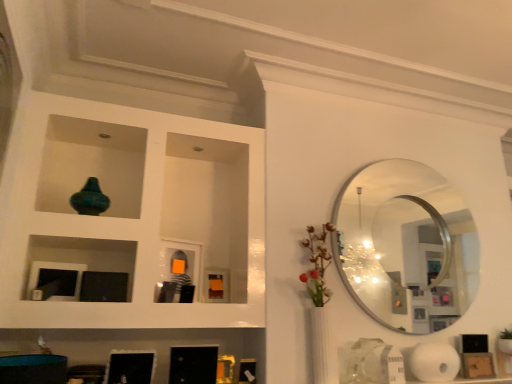
Question: Is teal glass vase at upper left smaller than silver metallic mirror at upper right?

Choices:
 (A) no
 (B) yes

Answer: (B)

Question: Is teal glass vase at upper left surrounding silver metallic mirror at upper right?

Choices:
 (A) yes
 (B) no

Answer: (B)

Question: Does teal glass vase at upper left have a lesser height compared to silver metallic mirror at upper right?

Choices:
 (A) no
 (B) yes

Answer: (B)

Question: From a real-world perspective, is teal glass vase at upper left located beneath silver metallic mirror at upper right?

Choices:
 (A) yes
 (B) no

Answer: (B)

Question: Does teal glass vase at upper left have a lesser width compared to silver metallic mirror at upper right?

Choices:
 (A) yes
 (B) no

Answer: (B)

Question: Considering the relative positions of teal glass vase at upper left and silver metallic mirror at upper right in the image provided, is teal glass vase at upper left to the right of silver metallic mirror at upper right from the viewer's perspective?

Choices:
 (A) yes
 (B) no

Answer: (B)

Question: Is white matte paper towel at lower right oriented away from silver metallic mirror at upper right?

Choices:
 (A) no
 (B) yes

Answer: (A)

Question: Does white matte paper towel at lower right have a greater height compared to silver metallic mirror at upper right?

Choices:
 (A) yes
 (B) no

Answer: (B)

Question: Does white matte paper towel at lower right have a lesser height compared to silver metallic mirror at upper right?

Choices:
 (A) no
 (B) yes

Answer: (B)

Question: Is there a large distance between white matte paper towel at lower right and silver metallic mirror at upper right?

Choices:
 (A) no
 (B) yes

Answer: (A)

Question: Does white matte paper towel at lower right have a lesser width compared to silver metallic mirror at upper right?

Choices:
 (A) yes
 (B) no

Answer: (B)

Question: Is white matte paper towel at lower right bigger than silver metallic mirror at upper right?

Choices:
 (A) no
 (B) yes

Answer: (A)

Question: Considering the relative sizes of white matte paper towel at lower right and teal glass vase at upper left in the image provided, is white matte paper towel at lower right thinner than teal glass vase at upper left?

Choices:
 (A) yes
 (B) no

Answer: (A)